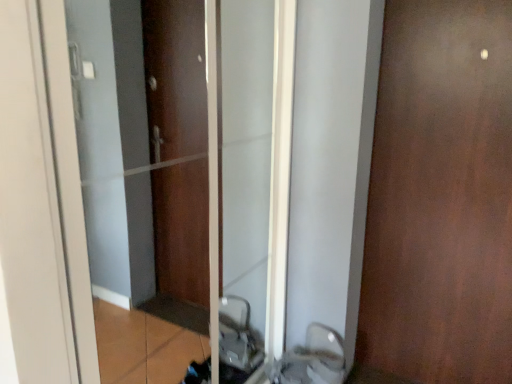
Question: Is white glossy sink at lower center oriented away from matte brown elevator at center?

Choices:
 (A) no
 (B) yes

Answer: (B)

Question: Is white glossy sink at lower center taller than matte brown elevator at center?

Choices:
 (A) yes
 (B) no

Answer: (B)

Question: Does white glossy sink at lower center appear on the left side of matte brown elevator at center?

Choices:
 (A) yes
 (B) no

Answer: (B)

Question: Considering the relative sizes of white glossy sink at lower center and matte brown elevator at center in the image provided, is white glossy sink at lower center bigger than matte brown elevator at center?

Choices:
 (A) yes
 (B) no

Answer: (B)

Question: From a real-world perspective, is white glossy sink at lower center beneath matte brown elevator at center?

Choices:
 (A) yes
 (B) no

Answer: (A)

Question: Does white glossy sink at lower center come in front of matte brown elevator at center?

Choices:
 (A) yes
 (B) no

Answer: (B)

Question: From a real-world perspective, does matte brown elevator at center sit lower than brown matte door at right?

Choices:
 (A) yes
 (B) no

Answer: (B)

Question: Considering the relative positions of matte brown elevator at center and brown matte door at right in the image provided, is matte brown elevator at center behind brown matte door at right?

Choices:
 (A) no
 (B) yes

Answer: (A)

Question: Is matte brown elevator at center bigger than brown matte door at right?

Choices:
 (A) no
 (B) yes

Answer: (B)

Question: Does matte brown elevator at center touch brown matte door at right?

Choices:
 (A) yes
 (B) no

Answer: (B)

Question: From the image's perspective, is matte brown elevator at center over brown matte door at right?

Choices:
 (A) yes
 (B) no

Answer: (B)

Question: From the image's perspective, is matte brown elevator at center beneath brown matte door at right?

Choices:
 (A) no
 (B) yes

Answer: (B)

Question: Does brown matte door at right come behind matte brown elevator at center?

Choices:
 (A) no
 (B) yes

Answer: (B)